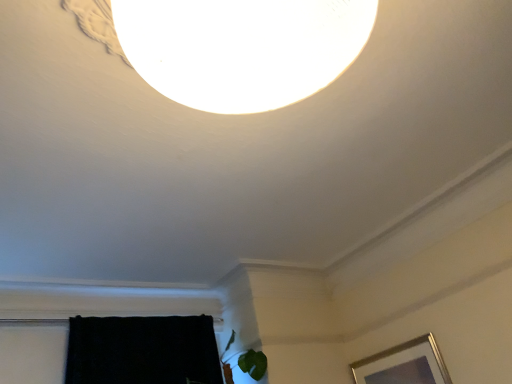
The image size is (512, 384). In order to click on silver metallic picture frame at lower right in this screenshot , I will do `click(404, 364)`.

What is the approximate width of silver metallic picture frame at lower right?

The width of silver metallic picture frame at lower right is 1.19 inches.

In the scene shown: Measure the distance between point (403,367) and camera.

A: Point (403,367) is 8.98 feet away from camera.

Describe the element at coordinates (404, 364) in the screenshot. I see `silver metallic picture frame at lower right` at that location.

Locate an element on the screen. The height and width of the screenshot is (384, 512). silver metallic picture frame at lower right is located at coordinates (404, 364).